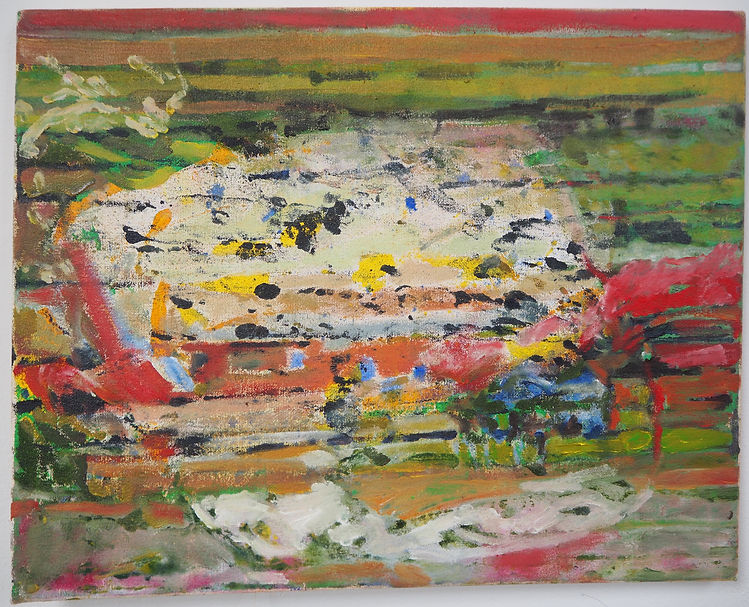
You are a GUI agent. You are given a task and a screenshot of the screen. Output one action in this format:
    pyautogui.click(x=<x>, y=<y>)
    Task: Click on the red paint
    
    Given the screenshot: What is the action you would take?
    pyautogui.click(x=670, y=303), pyautogui.click(x=121, y=387), pyautogui.click(x=461, y=362), pyautogui.click(x=518, y=578), pyautogui.click(x=79, y=582), pyautogui.click(x=538, y=16)